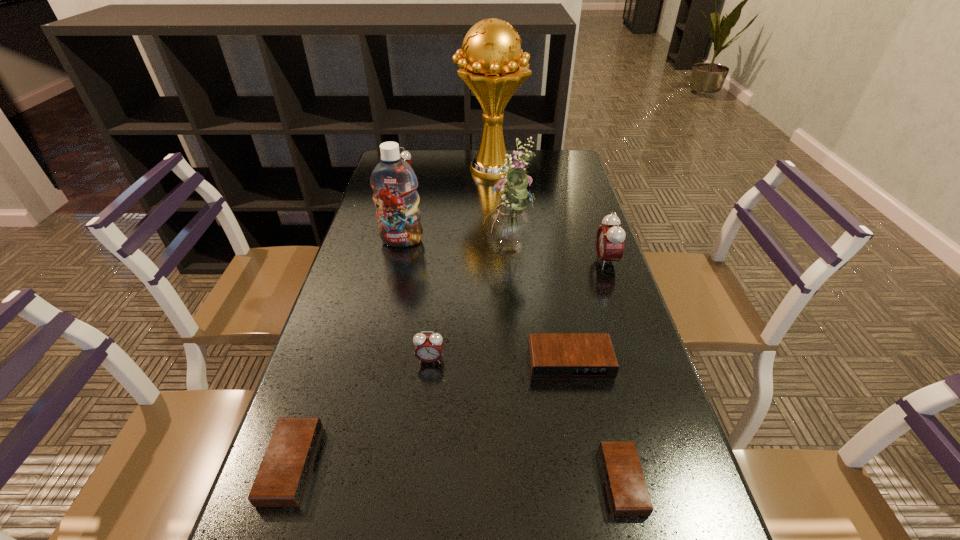
Locate which alarm clock ranks in proximity to the fourth tallest alarm clock. Please provide its 2D coordinates. Your answer should be formatted as a tuple, i.e. [(x, y)], where the tuple contains the x and y coordinates of a point satisfying the conditions above.

[(628, 494)]

In order to click on alarm clock that stands as the second closest to the green bouquet in this screenshot , I will do `click(551, 355)`.

Point out which pink alarm clock is positioned as the nearest to the seventh tallest object. Please provide its 2D coordinates. Your answer should be formatted as a tuple, i.e. [(x, y)], where the tuple contains the x and y coordinates of a point satisfying the conditions above.

[(428, 348)]

Where is `pink alarm clock object that ranks as the closest to the farthest black alarm clock`? This screenshot has width=960, height=540. pink alarm clock object that ranks as the closest to the farthest black alarm clock is located at coordinates (428, 348).

The image size is (960, 540). What are the coordinates of `black alarm clock identified as the second closest to the fourth shortest alarm clock` in the screenshot? It's located at (282, 477).

Choose which black alarm clock is the second nearest neighbor to the rightmost object. Please provide its 2D coordinates. Your answer should be formatted as a tuple, i.e. [(x, y)], where the tuple contains the x and y coordinates of a point satisfying the conditions above.

[(628, 494)]

Where is `free space that satisfies the following two spatial constraints: 1. on the front label of the shampoo; 2. on the front face of the second biggest black alarm clock`? This screenshot has width=960, height=540. free space that satisfies the following two spatial constraints: 1. on the front label of the shampoo; 2. on the front face of the second biggest black alarm clock is located at coordinates (351, 465).